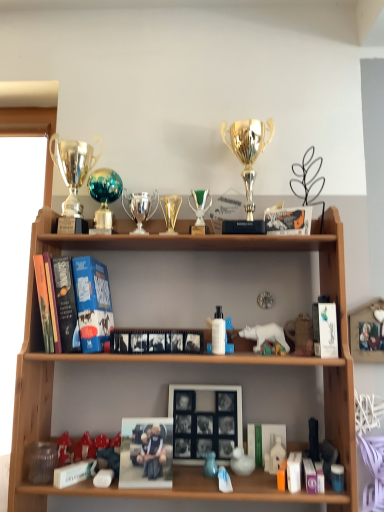
Question: Is white plastic bear at center, arranged as the 6th toy when viewed from the left, thinner than green glass trophy at center, the 2th candle holder in the left-to-right sequence?

Choices:
 (A) yes
 (B) no

Answer: (A)

Question: Does white plastic bear at center, arranged as the 6th toy when viewed from the left, come behind green glass trophy at center, placed as the first candle holder when sorted from right to left?

Choices:
 (A) yes
 (B) no

Answer: (B)

Question: Considering the relative positions of white plastic bear at center, arranged as the 6th toy when viewed from the left, and green glass trophy at center, placed as the first candle holder when sorted from right to left, in the image provided, is white plastic bear at center, arranged as the 6th toy when viewed from the left, to the left of green glass trophy at center, placed as the first candle holder when sorted from right to left, from the viewer's perspective?

Choices:
 (A) no
 (B) yes

Answer: (A)

Question: Is white plastic bear at center, which ranks as the 4th toy in right-to-left order, positioned with its back to green glass trophy at center, placed as the first candle holder when sorted from right to left?

Choices:
 (A) yes
 (B) no

Answer: (B)

Question: Does white plastic bear at center, which ranks as the 4th toy in right-to-left order, lie in front of green glass trophy at center, the 2th candle holder in the left-to-right sequence?

Choices:
 (A) no
 (B) yes

Answer: (B)

Question: From their relative heights in the image, would you say teal glass trophy at upper center, positioned as the second trophy in right-to-left order, is taller or shorter than white matte rubber duck at lower center, acting as the 5th toy starting from the right?

Choices:
 (A) tall
 (B) short

Answer: (A)

Question: In the image, is teal glass trophy at upper center, the second trophy from the left, positioned in front of or behind white matte rubber duck at lower center, acting as the 5th toy starting from the right?

Choices:
 (A) front
 (B) behind

Answer: (B)

Question: Considering the positions of teal glass trophy at upper center, the second trophy from the left, and white matte rubber duck at lower center, marked as the 5th toy in a left-to-right arrangement, in the image, is teal glass trophy at upper center, the second trophy from the left, wider or thinner than white matte rubber duck at lower center, marked as the 5th toy in a left-to-right arrangement,?

Choices:
 (A) thin
 (B) wide

Answer: (B)

Question: Considering the positions of teal glass trophy at upper center, the second trophy from the left, and white matte rubber duck at lower center, acting as the 5th toy starting from the right, in the image, is teal glass trophy at upper center, the second trophy from the left, bigger or smaller than white matte rubber duck at lower center, acting as the 5th toy starting from the right,?

Choices:
 (A) big
 (B) small

Answer: (A)

Question: In the image, is wooden shelf at center on the left side or the right side of matte white figurine at lower center, the sixth toy when ordered from right to left?

Choices:
 (A) left
 (B) right

Answer: (A)

Question: Is wooden shelf at center taller or shorter than matte white figurine at lower center, the sixth toy when ordered from right to left?

Choices:
 (A) tall
 (B) short

Answer: (A)

Question: Considering the positions of wooden shelf at center and matte white figurine at lower center, the sixth toy when ordered from right to left, in the image, is wooden shelf at center wider or thinner than matte white figurine at lower center, the sixth toy when ordered from right to left,?

Choices:
 (A) thin
 (B) wide

Answer: (B)

Question: Based on their sizes in the image, would you say wooden shelf at center is bigger or smaller than matte white figurine at lower center, the sixth toy when ordered from right to left?

Choices:
 (A) big
 (B) small

Answer: (A)

Question: Which is correct: transparent plastic jar at lower left, which is the 1th toy from left to right, is inside wooden shelf at center, or outside of it?

Choices:
 (A) outside
 (B) inside

Answer: (B)

Question: From the image's perspective, is transparent plastic jar at lower left, which is the 1th toy from left to right, above or below wooden shelf at center?

Choices:
 (A) below
 (B) above

Answer: (A)